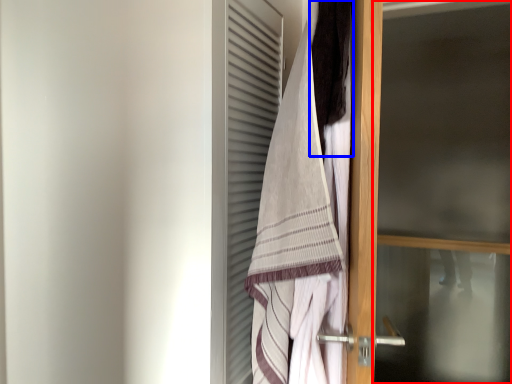
Question: Among these objects, which one is farthest to the camera, screen door (highlighted by a red box) or hair (highlighted by a blue box)?

Choices:
 (A) screen door
 (B) hair

Answer: (A)